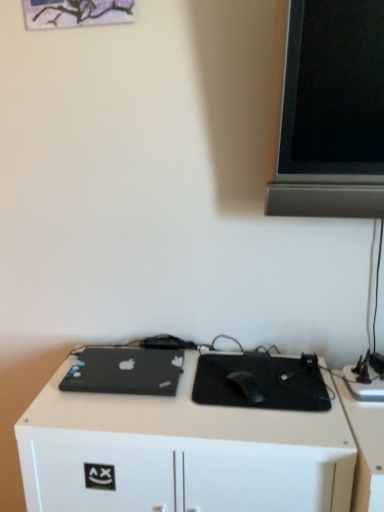
Question: Should I look upward or downward to see white matte desk at center?

Choices:
 (A) up
 (B) down

Answer: (B)

Question: Does white matte desk at center appear on the left side of black matte mouse at center?

Choices:
 (A) no
 (B) yes

Answer: (B)

Question: From a real-world perspective, is white matte desk at center positioned over black matte mouse at center based on gravity?

Choices:
 (A) yes
 (B) no

Answer: (B)

Question: Can you confirm if white matte desk at center is wider than black matte mouse at center?

Choices:
 (A) yes
 (B) no

Answer: (A)

Question: Is there a large distance between white matte desk at center and black matte mouse at center?

Choices:
 (A) yes
 (B) no

Answer: (B)

Question: Can you confirm if white matte desk at center is positioned to the right of black matte mouse at center?

Choices:
 (A) no
 (B) yes

Answer: (A)

Question: Does white matte desk at center come behind black matte mouse at center?

Choices:
 (A) yes
 (B) no

Answer: (B)

Question: Is black matte mouse at center in front of black matte laptop at lower left?

Choices:
 (A) no
 (B) yes

Answer: (B)

Question: From the image's perspective, is black matte mouse at center on black matte laptop at lower left?

Choices:
 (A) yes
 (B) no

Answer: (B)

Question: Considering the relative sizes of black matte mouse at center and black matte laptop at lower left in the image provided, is black matte mouse at center taller than black matte laptop at lower left?

Choices:
 (A) yes
 (B) no

Answer: (A)

Question: Is black matte mouse at center surrounding black matte laptop at lower left?

Choices:
 (A) yes
 (B) no

Answer: (B)

Question: Is black matte mouse at center at the left side of black matte laptop at lower left?

Choices:
 (A) no
 (B) yes

Answer: (A)

Question: Is black matte mouse at center aimed at black matte laptop at lower left?

Choices:
 (A) no
 (B) yes

Answer: (A)

Question: Is black matte laptop at lower left with white matte desk at center?

Choices:
 (A) no
 (B) yes

Answer: (A)